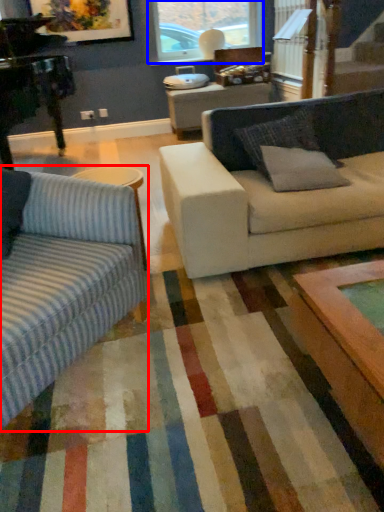
Question: Which point is closer to the camera, studio couch (highlighted by a red box) or window (highlighted by a blue box)?

Choices:
 (A) studio couch
 (B) window

Answer: (A)